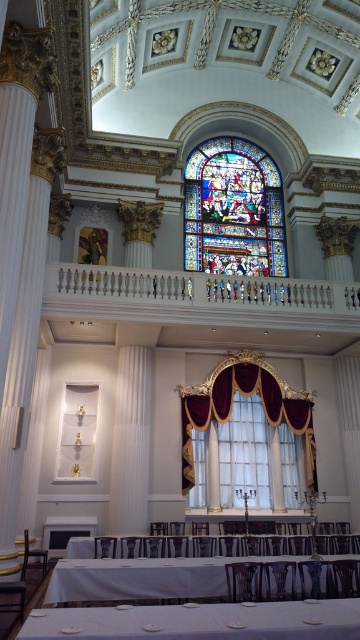
Question: Can you confirm if white cloth table at lower center is thinner than velvet drapery at center?

Choices:
 (A) no
 (B) yes

Answer: (A)

Question: Does velvet drapery at center appear over velvet curtain at center?

Choices:
 (A) no
 (B) yes

Answer: (B)

Question: Based on their relative distances, which object is nearer to the white matte table at lower center?

Choices:
 (A) stained glass at upper center
 (B) white marble railing at upper center
 (C) velvet drapery at center

Answer: (B)

Question: Observing the image, what is the correct spatial positioning of velvet curtain at center in reference to white glossy table at lower center?

Choices:
 (A) above
 (B) below

Answer: (A)

Question: Which of these objects is positioned closest to the velvet drapery at center?

Choices:
 (A) white cloth table at lower center
 (B) white glossy table at lower center
 (C) velvet curtain at right

Answer: (C)

Question: Which of the following is the farthest from the observer?

Choices:
 (A) (308, 637)
 (B) (214, 184)
 (C) (160, 316)
 (D) (338, 401)

Answer: (B)